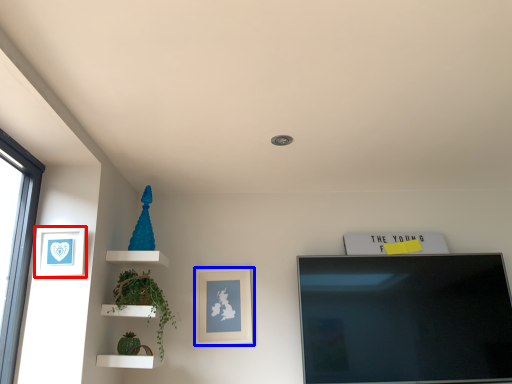
Question: Which of the following is the farthest to the observer, picture frame (highlighted by a red box) or picture frame (highlighted by a blue box)?

Choices:
 (A) picture frame
 (B) picture frame

Answer: (B)